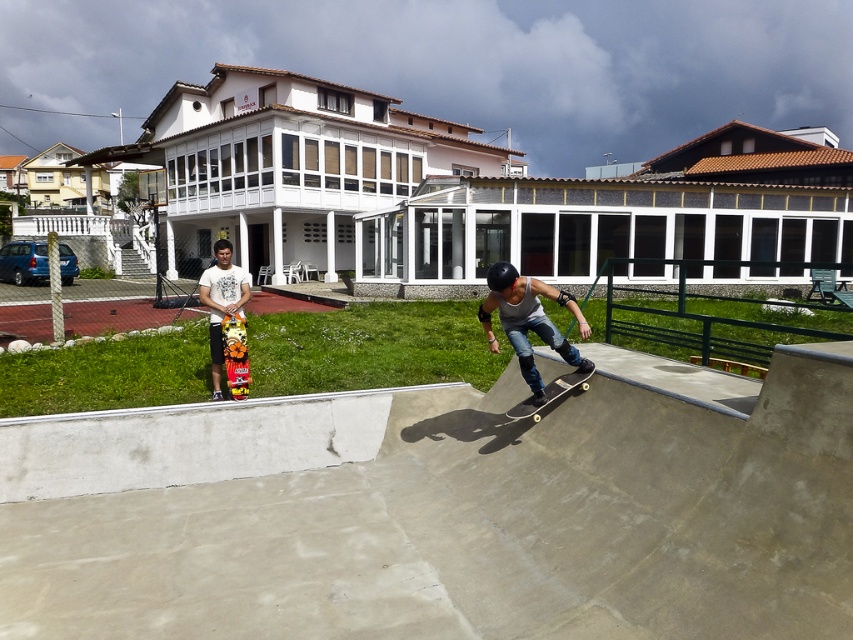
Question: In this image, where is matte gray tank top at center located relative to black smooth skateboard at center?

Choices:
 (A) right
 (B) left

Answer: (B)

Question: Which object appears farthest from the camera in this image?

Choices:
 (A) multicolored wooden skateboard at center
 (B) white t-shirt at center
 (C) matte gray tank top at center
 (D) black smooth skateboard at center

Answer: (B)

Question: Which of these objects is positioned closest to the concrete ramp at center?

Choices:
 (A) matte gray tank top at center
 (B) multicolored wooden skateboard at center
 (C) black smooth skateboard at center

Answer: (C)

Question: Which point is closer to the camera?

Choices:
 (A) (236, 323)
 (B) (234, 305)
 (C) (549, 384)
 (D) (485, 323)

Answer: (D)

Question: Does concrete ramp at center lie in front of matte gray tank top at center?

Choices:
 (A) yes
 (B) no

Answer: (A)

Question: Is multicolored wooden skateboard at center positioned behind black smooth skateboard at center?

Choices:
 (A) no
 (B) yes

Answer: (B)